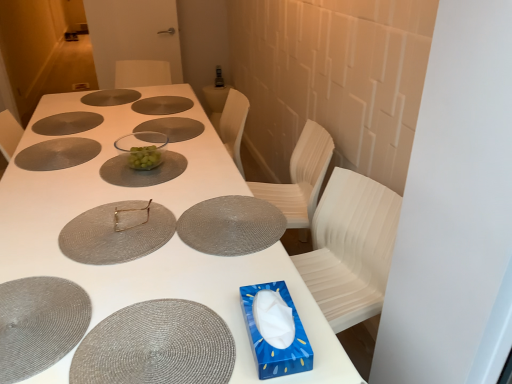
Locate an element on the screen. This screenshot has height=384, width=512. vacant area that lies in front of matte gray placemat at center, arranged as the second glass plate when viewed from the front is located at coordinates (122, 273).